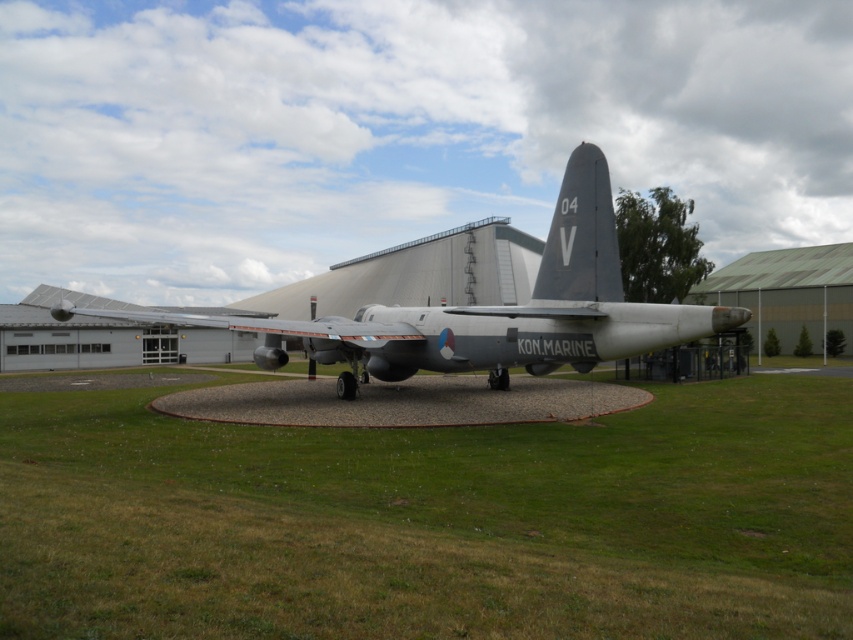
You are standing in front of the silver metallic airplane at center and want to walk towards the green grass at center. In which direction should you move?

The green grass at center is to the right of the silver metallic airplane at center, so you should move to your right to reach it.

You are standing at the edge of the circular gravel pad where the Lockheed P2 Neptune is displayed. You want to walk towards the green grass at center. Which direction should you walk?

You should walk towards the center of the circular gravel pad to reach the green grass at center.